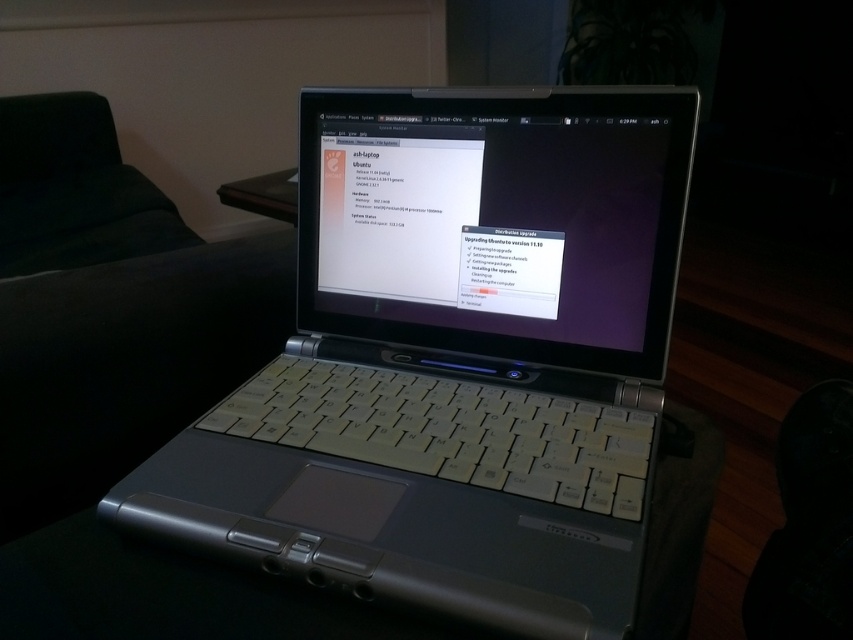
You are standing in the room where the laptop is placed. You see two points marked on the floor, point 1 at coordinates point (19, 483) and point 2 at coordinates point (392, 611). Which point is closer to you?

Point 1 at coordinates point (19, 483) is closer to you because it is behind point 2 at coordinates point (392, 611).

From the picture: You are trying to place a large book on the black plastic table at center and the dark green fabric at left. Which surface can accommodate the book without it hanging over the edges?

The dark green fabric at left can accommodate the book without it hanging over the edges because it has a larger size compared to the black plastic table at center.

You are setting up a workspace and need to place both the silver metallic laptop at center and the black plastic table at center on a desk. Which object requires more desk space due to its size?

The silver metallic laptop at center requires more desk space because it is bigger than the black plastic table at center.